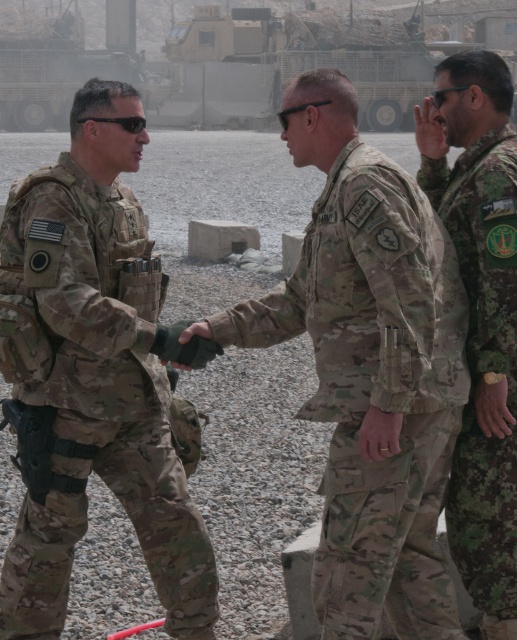
Question: Does camouflage uniform at center appear on the right side of camouflage fabric uniform at center?

Choices:
 (A) yes
 (B) no

Answer: (B)

Question: Which point appears closest to the camera in this image?

Choices:
 (A) (497, 442)
 (B) (447, 376)
 (C) (118, 108)

Answer: (B)

Question: Is camouflage uniform at center further to the viewer compared to camouflage fabric uniform at center?

Choices:
 (A) no
 (B) yes

Answer: (B)

Question: Which point appears closest to the camera in this image?

Choices:
 (A) (503, 586)
 (B) (33, 586)

Answer: (A)

Question: In this image, where is camouflage uniform at center located relative to camouflage fabric uniform at right?

Choices:
 (A) above
 (B) below

Answer: (B)

Question: Which is farther from the camouflage fabric uniform at right?

Choices:
 (A) camouflage uniform at center
 (B) camouflage fabric uniform at center

Answer: (A)